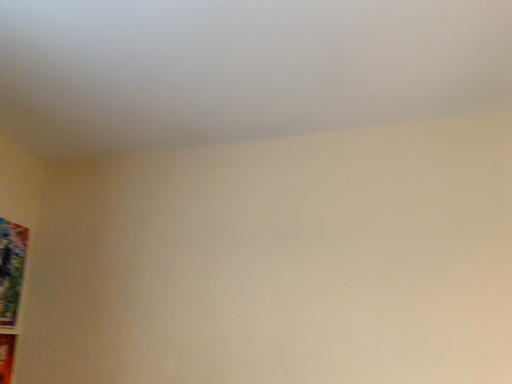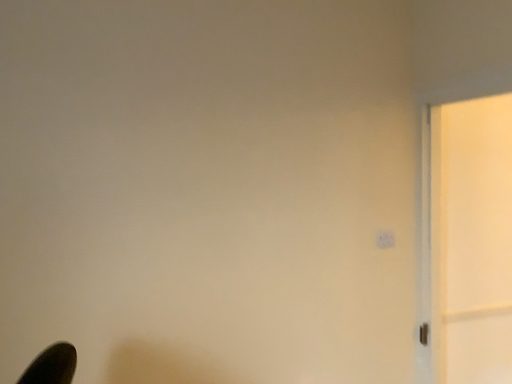
Question: Which way did the camera rotate in the video?

Choices:
 (A) rotated left
 (B) rotated right

Answer: (B)